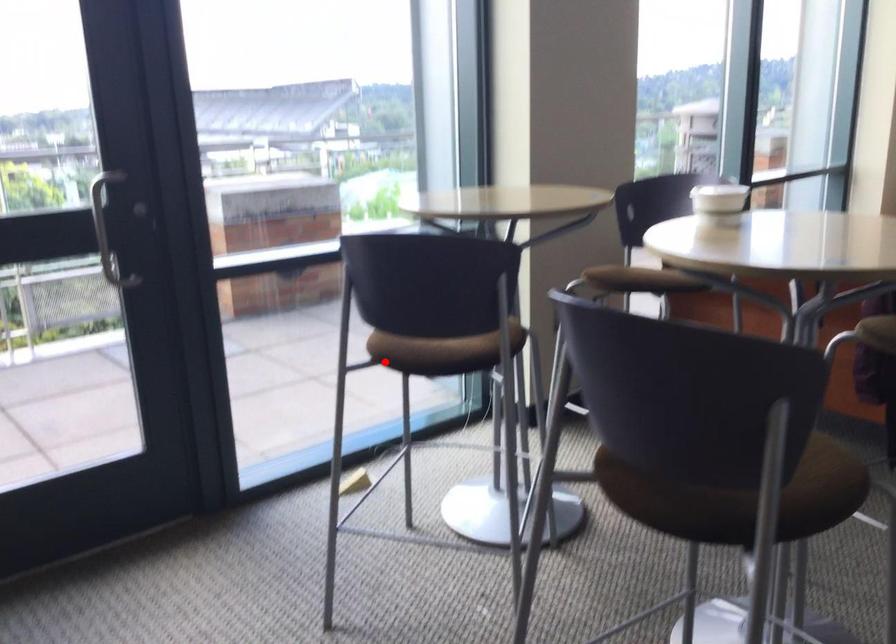
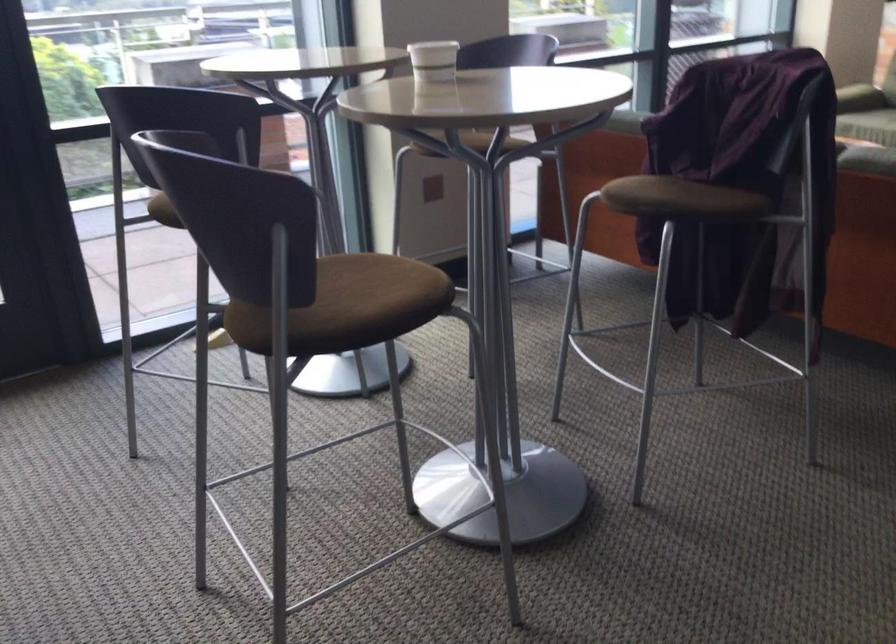
Question: I am providing you with two images of the same scene from different viewpoints. A red point is marked on the first image. Is the red point's position out of view in image 2?

Choices:
 (A) Yes
 (B) No

Answer: (B)